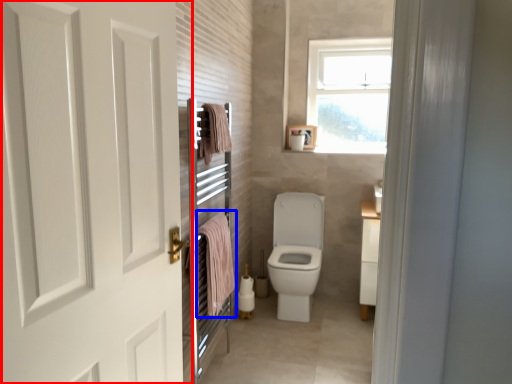
Question: Which point is further to the camera, door (highlighted by a red box) or bath towel (highlighted by a blue box)?

Choices:
 (A) door
 (B) bath towel

Answer: (B)